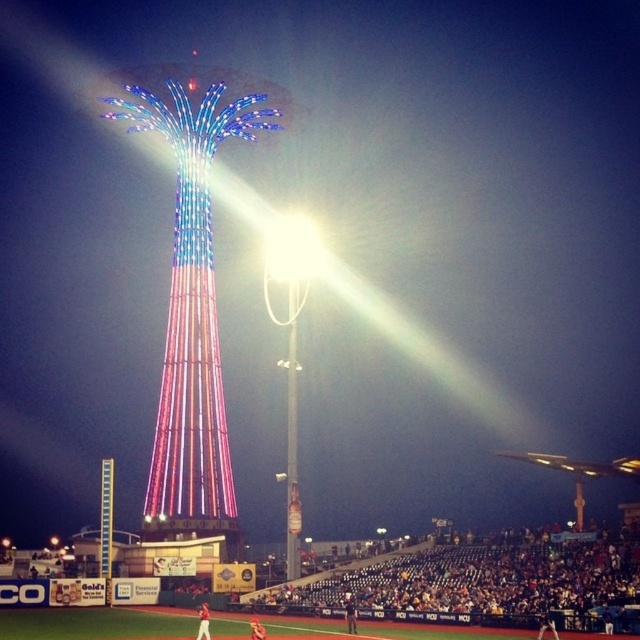
Can you confirm if shiny metallic tower at center is smaller than dark blue jersey at lower center?

Incorrect, shiny metallic tower at center is not smaller in size than dark blue jersey at lower center.

Is shiny metallic tower at center bigger than dark blue jersey at lower center?

Correct, shiny metallic tower at center is larger in size than dark blue jersey at lower center.

Between point (179, 435) and point (464, 544), which one is positioned behind?

The point (464, 544) is behind.

Find the location of a particular element. This screenshot has height=640, width=640. shiny metallic tower at center is located at coordinates (193, 305).

Between point (632, 602) and point (307, 236), which one is positioned in front?

Point (632, 602)

Can you confirm if dark blue jersey at lower center is taller than bright white lamp post at center?

No, dark blue jersey at lower center is not taller than bright white lamp post at center.

Is point (573, 595) closer to viewer compared to point (285, 232)?

Yes.

The width and height of the screenshot is (640, 640). Find the location of `dark blue jersey at lower center`. dark blue jersey at lower center is located at coordinates (490, 584).

Which is above, shiny metallic tower at center or bright white lamp post at center?

bright white lamp post at center

Is shiny metallic tower at center shorter than bright white lamp post at center?

No, shiny metallic tower at center is not shorter than bright white lamp post at center.

What do you see at coordinates (193, 305) in the screenshot? I see `shiny metallic tower at center` at bounding box center [193, 305].

Where is `shiny metallic tower at center`? This screenshot has width=640, height=640. shiny metallic tower at center is located at coordinates (193, 305).